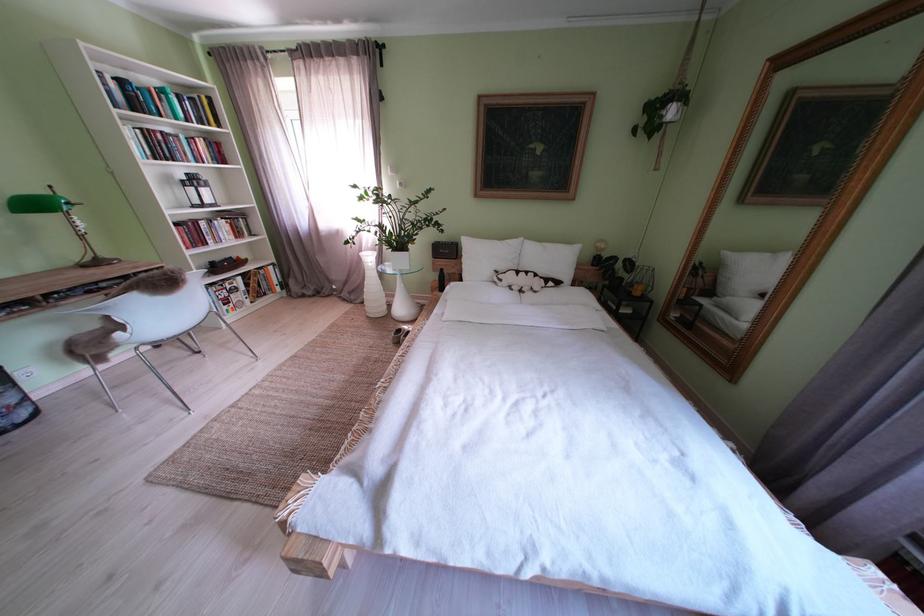
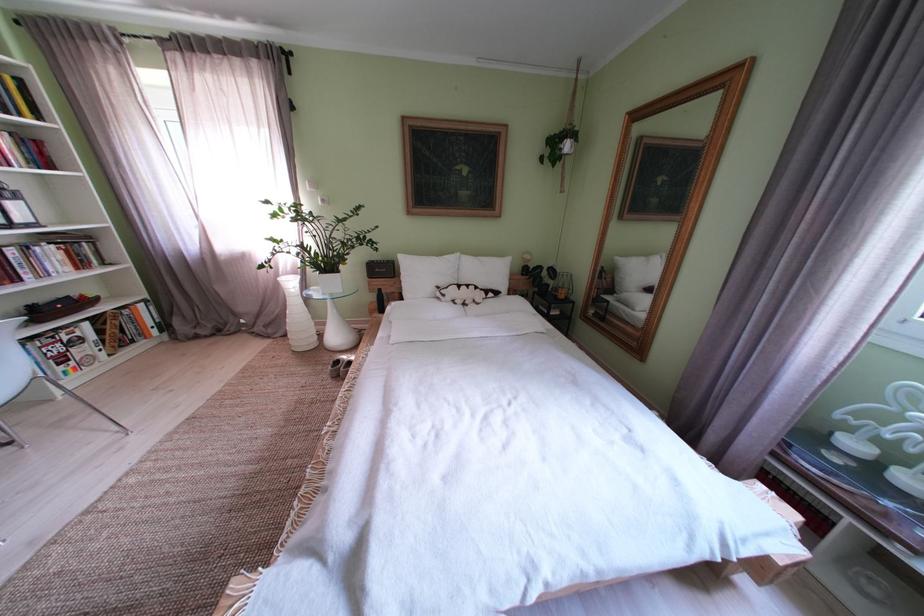
Where in the second image is the point corresponding to point 557,249 from the first image?

(492, 264)